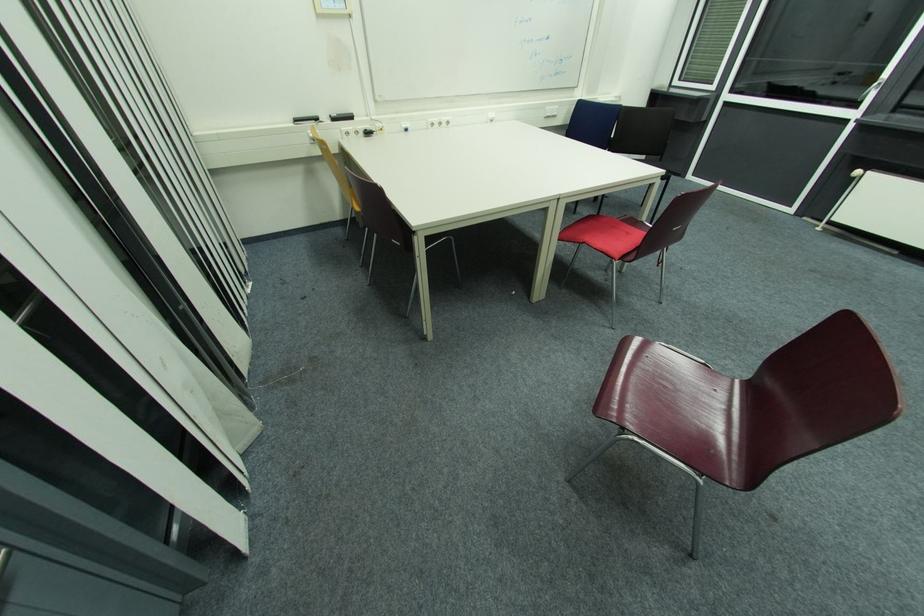
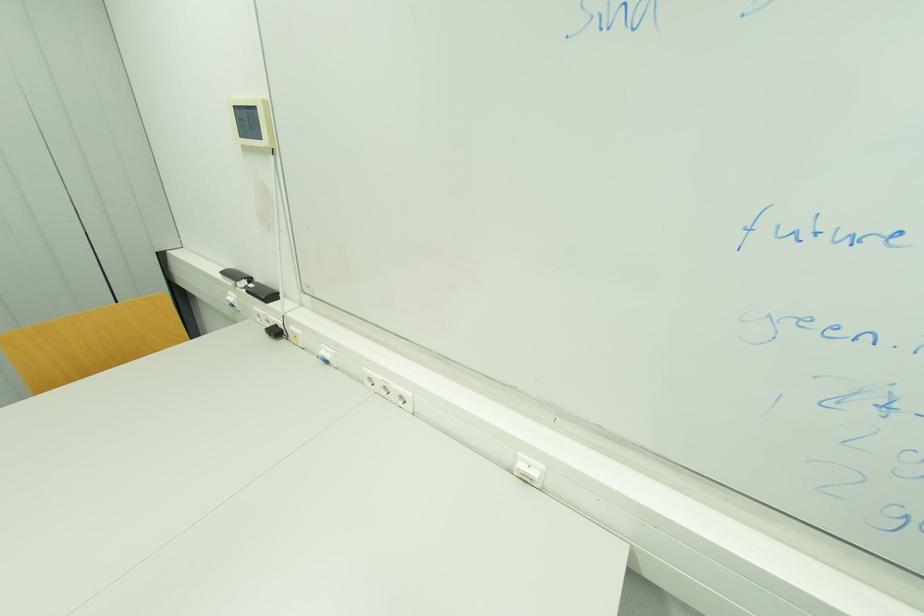
In the second image, find the point that corresponds to (371,134) in the first image.

(281, 333)